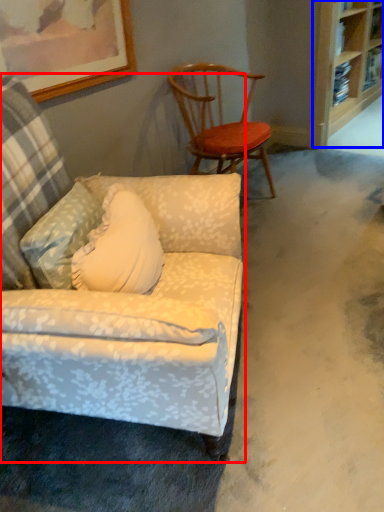
Question: Which object appears closest to the camera in this image, chair (highlighted by a red box) or shelf (highlighted by a blue box)?

Choices:
 (A) chair
 (B) shelf

Answer: (A)